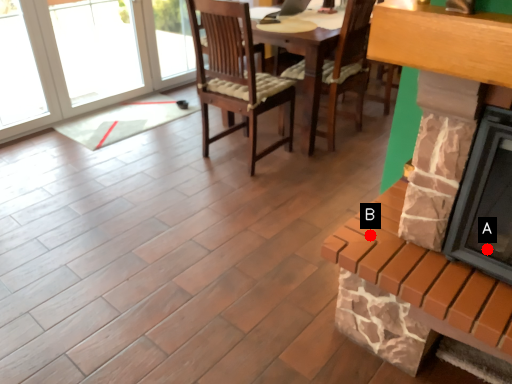
Question: Two points are circled on the image, labeled by A and B beside each circle. Which point appears farthest from the camera in this image?

Choices:
 (A) A is further
 (B) B is further

Answer: (B)